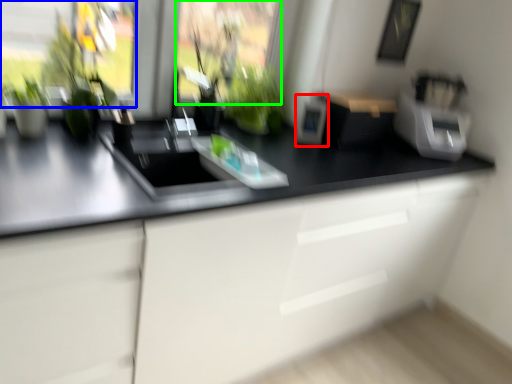
Question: Which object is positioned closest to appliance (highlighted by a red box)? Select from window screen (highlighted by a blue box) and window screen (highlighted by a green box).

Choices:
 (A) window screen
 (B) window screen

Answer: (B)